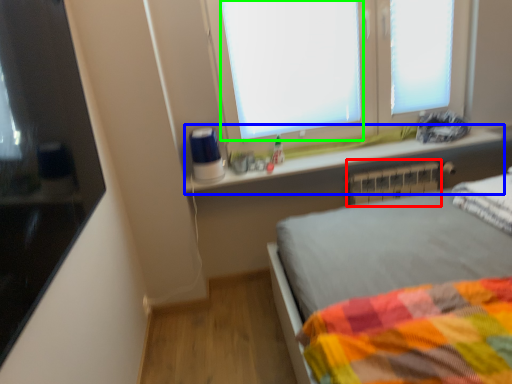
Question: Which object is positioned closest to radiator (highlighted by a red box)? Select from window sill (highlighted by a blue box) and window screen (highlighted by a green box).

Choices:
 (A) window sill
 (B) window screen

Answer: (A)